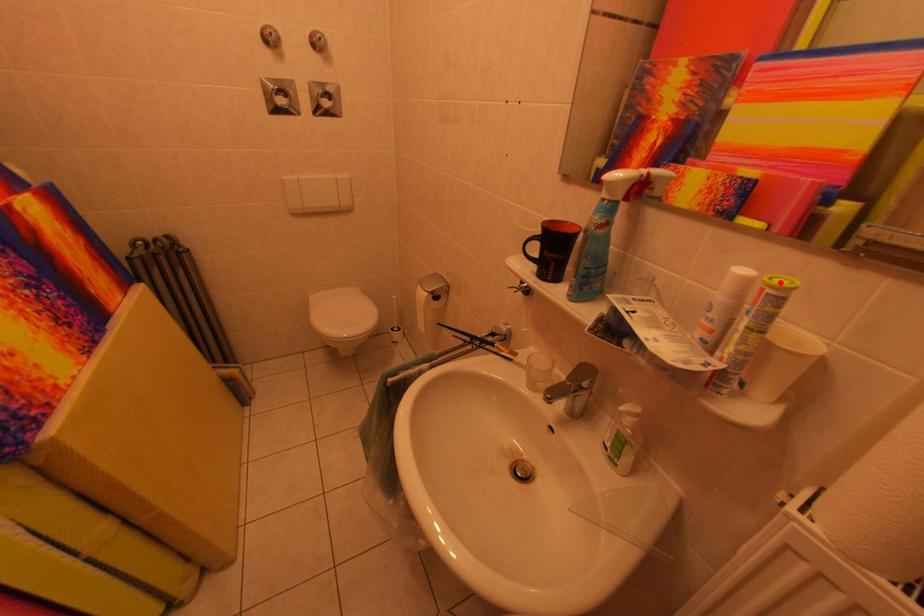
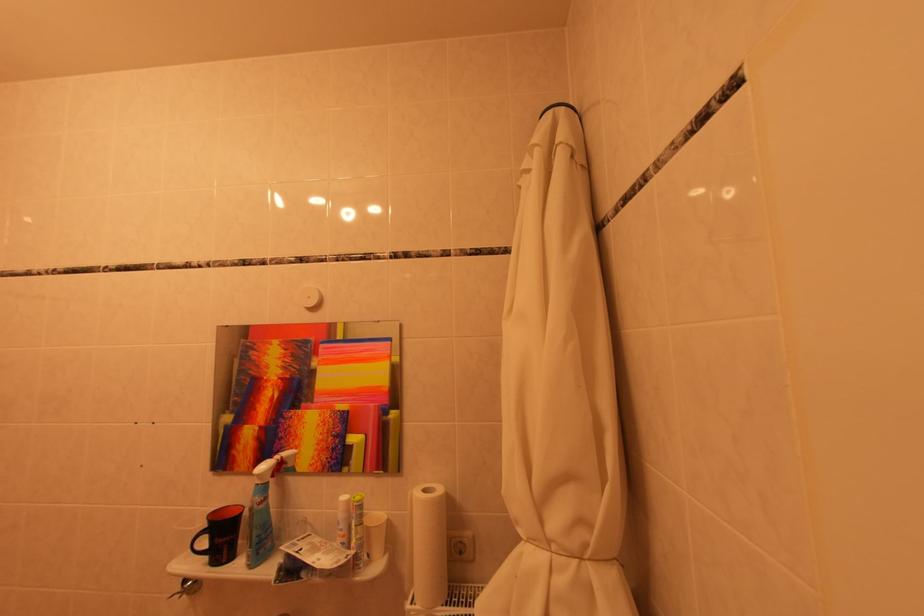
The point at the highlighted location is marked in the first image. Where is the corresponding point in the second image?

(362, 501)